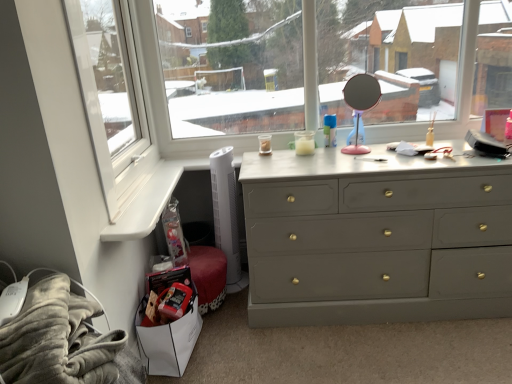
Question: Is fuzzy gray blanket at lower left to the left or to the right of pink plastic mirror at upper center in the image?

Choices:
 (A) right
 (B) left

Answer: (B)

Question: Is fuzzy gray blanket at lower left spatially inside pink plastic mirror at upper center, or outside of it?

Choices:
 (A) inside
 (B) outside

Answer: (B)

Question: Which object is the farthest from the fuzzy gray blanket at lower left?

Choices:
 (A) pink plastic mirror at upper center
 (B) white plastic window frame at left
 (C) white plastic window sill at lower left
 (D) matte gray dresser at center

Answer: (A)

Question: Which object is positioned closest to the white plastic window sill at lower left?

Choices:
 (A) white plastic window frame at left
 (B) matte gray dresser at center
 (C) pink plastic mirror at upper center
 (D) fuzzy gray blanket at lower left

Answer: (A)